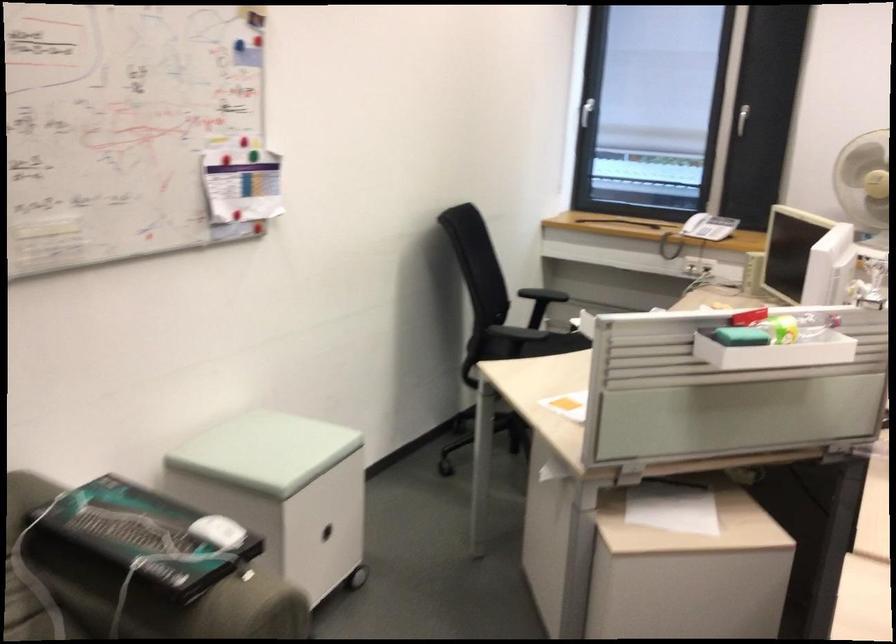
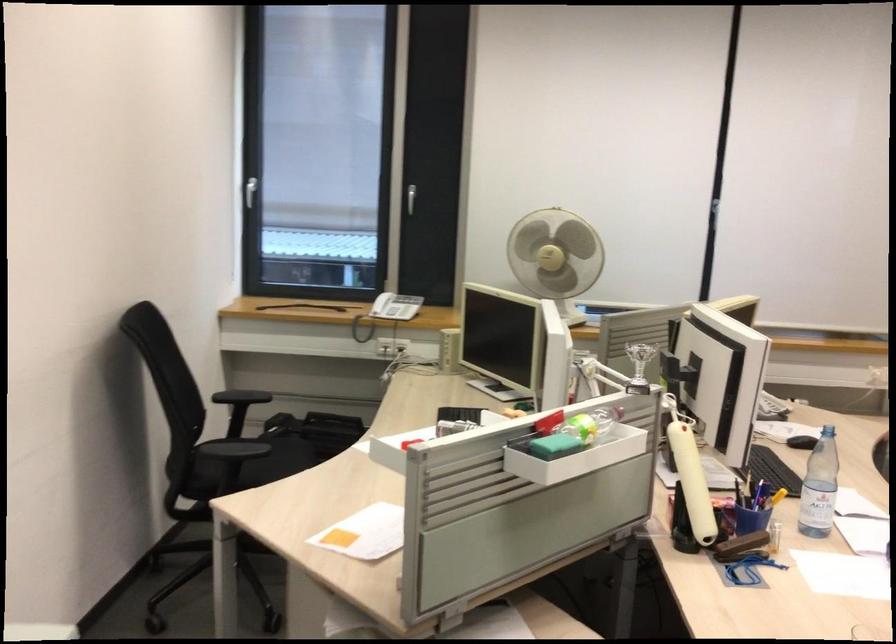
Question: Based on the continuous images, in which direction is the camera rotating? Reply with the corresponding letter.

Choices:
 (A) Left
 (B) Right
 (C) Up
 (D) Down

Answer: (B)